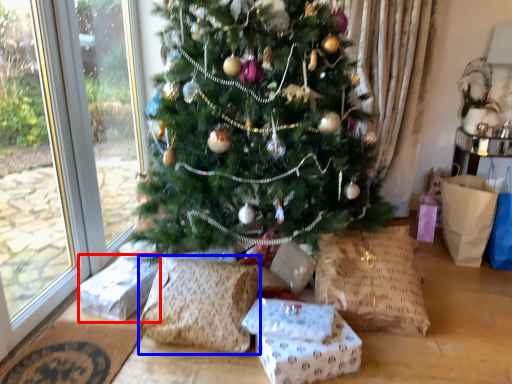
Question: Which point is closer to the camera, gift box (highlighted by a red box) or pillow (highlighted by a blue box)?

Choices:
 (A) gift box
 (B) pillow

Answer: (B)